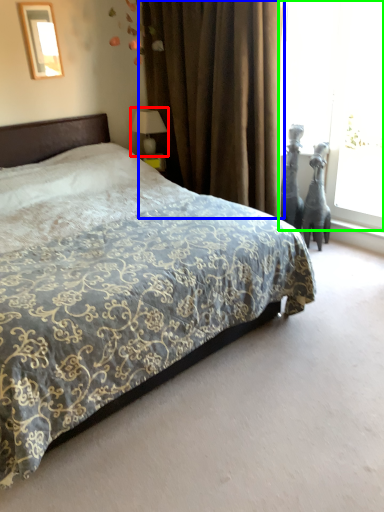
Question: Based on their relative distances, which object is farther from table lamp (highlighted by a red box)? Choose from curtain (highlighted by a blue box) and window screen (highlighted by a green box).

Choices:
 (A) curtain
 (B) window screen

Answer: (B)